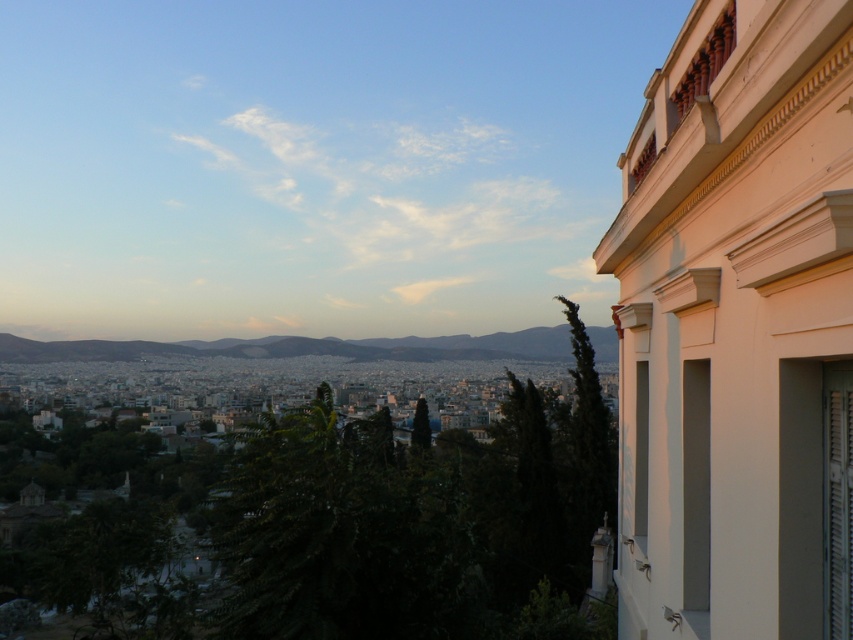
Is white painted wood balcony at upper right thinner than green grassy hill at center?

Yes.

Which is more to the left, white painted wood balcony at upper right or green grassy hill at center?

From the viewer's perspective, green grassy hill at center appears more on the left side.

Between point (732, 292) and point (360, 355), which one is positioned in front?

Point (732, 292) is more forward.

Locate an element on the screen. The height and width of the screenshot is (640, 853). white painted wood balcony at upper right is located at coordinates [737, 330].